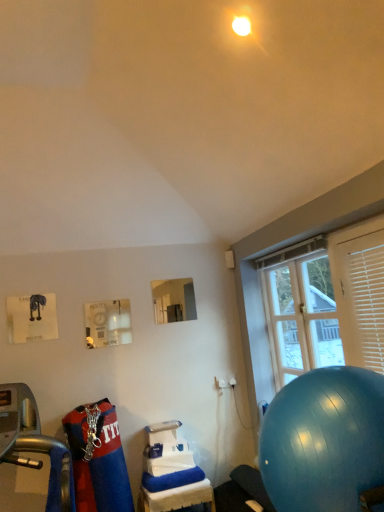
Question: Can you confirm if blue rubber ball at lower right is wider than white plastic table at lower center?

Choices:
 (A) no
 (B) yes

Answer: (B)

Question: Does blue rubber ball at lower right have a lesser width compared to white plastic table at lower center?

Choices:
 (A) yes
 (B) no

Answer: (B)

Question: Does blue rubber ball at lower right appear on the right side of white plastic table at lower center?

Choices:
 (A) yes
 (B) no

Answer: (A)

Question: Is blue rubber ball at lower right looking in the opposite direction of white plastic table at lower center?

Choices:
 (A) yes
 (B) no

Answer: (B)

Question: Would you say blue rubber ball at lower right contains white plastic table at lower center?

Choices:
 (A) yes
 (B) no

Answer: (B)

Question: Is blue rubber ball at lower right to the left or to the right of white plastic table at lower center in the image?

Choices:
 (A) left
 (B) right

Answer: (B)

Question: Considering the positions of point (278, 448) and point (144, 504), is point (278, 448) closer or farther from the camera than point (144, 504)?

Choices:
 (A) farther
 (B) closer

Answer: (B)

Question: From a real-world perspective, relative to white plastic table at lower center, is blue rubber ball at lower right vertically above or below?

Choices:
 (A) below
 (B) above

Answer: (B)

Question: Considering their positions, is blue rubber ball at lower right located in front of or behind white plastic table at lower center?

Choices:
 (A) behind
 (B) front

Answer: (B)

Question: From a real-world perspective, is white plastic blinds at right positioned above or below clear glass window at right?

Choices:
 (A) above
 (B) below

Answer: (A)

Question: In terms of size, does white plastic blinds at right appear bigger or smaller than clear glass window at right?

Choices:
 (A) big
 (B) small

Answer: (B)

Question: Based on their positions, is white plastic blinds at right located to the left or right of clear glass window at right?

Choices:
 (A) right
 (B) left

Answer: (A)

Question: Relative to clear glass window at right, is white plastic blinds at right in front or behind?

Choices:
 (A) behind
 (B) front

Answer: (B)

Question: From the image's perspective, relative to blue rubber ball at lower right, is clear glass window at right above or below?

Choices:
 (A) below
 (B) above

Answer: (B)

Question: In terms of height, does clear glass window at right look taller or shorter compared to blue rubber ball at lower right?

Choices:
 (A) tall
 (B) short

Answer: (A)